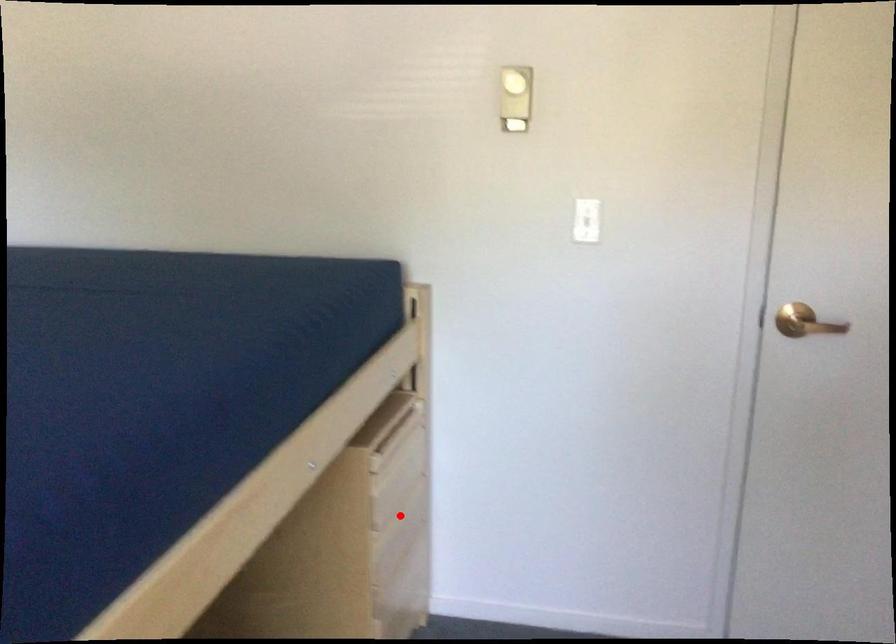
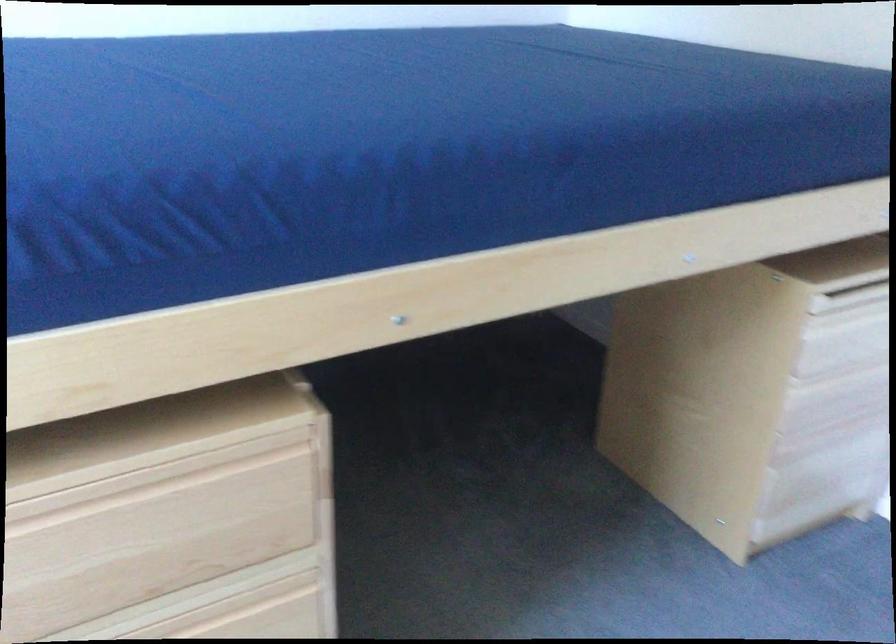
In the second image, find the point that corresponds to the highlighted location in the first image.

(845, 381)